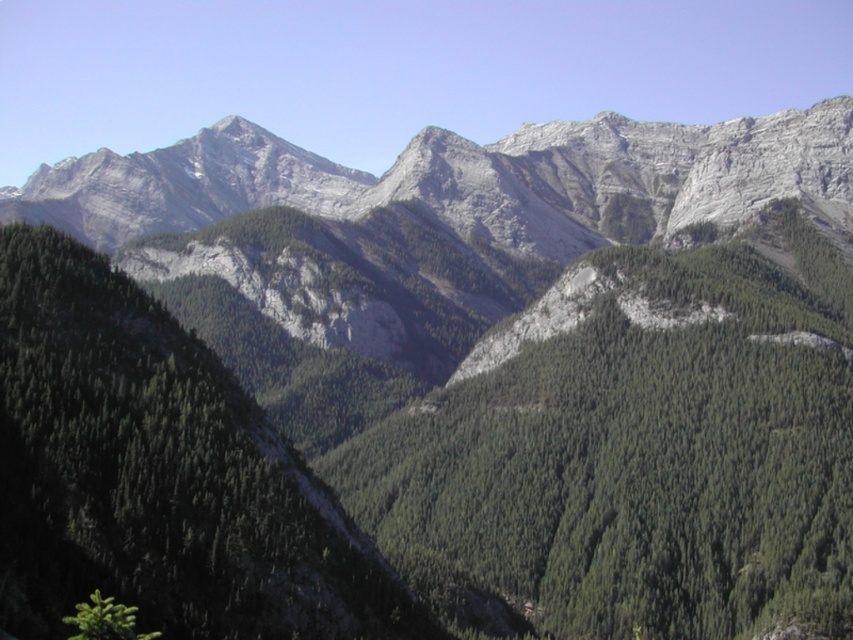
Question: Does gray rocky mountain range at center appear under green matte tree at lower left?

Choices:
 (A) no
 (B) yes

Answer: (A)

Question: Considering the relative positions of gray rocky mountain range at center and green matte tree at lower left in the image provided, where is gray rocky mountain range at center located with respect to green matte tree at lower left?

Choices:
 (A) below
 (B) above

Answer: (B)

Question: Does gray rocky mountain range at center come in front of green matte tree at lower left?

Choices:
 (A) yes
 (B) no

Answer: (B)

Question: Which object is farther from the camera taking this photo?

Choices:
 (A) gray rocky mountain range at center
 (B) green matte tree at lower left

Answer: (A)

Question: Which object is closer to the camera taking this photo?

Choices:
 (A) gray rocky mountain range at center
 (B) green matte tree at lower left

Answer: (B)

Question: Which of the following is the closest to the observer?

Choices:
 (A) green matte tree at lower left
 (B) gray rocky mountain range at center

Answer: (A)